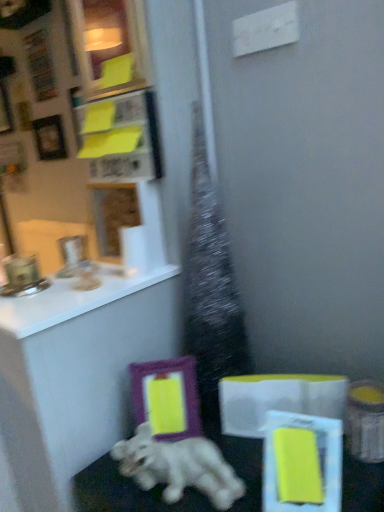
Question: Is matte yellow picture frame at upper left, arranged as the second picture frame when viewed from the top, in contact with white glossy countertop at upper left?

Choices:
 (A) no
 (B) yes

Answer: (A)

Question: Is white glossy countertop at upper left located within matte yellow picture frame at upper left, which is the 3th picture frame from left to right?

Choices:
 (A) no
 (B) yes

Answer: (A)

Question: Is matte yellow picture frame at upper left, which is the 3th picture frame from left to right, taller than white glossy countertop at upper left?

Choices:
 (A) no
 (B) yes

Answer: (B)

Question: From a real-world perspective, is matte yellow picture frame at upper left, arranged as the second picture frame when viewed from the top, under white glossy countertop at upper left?

Choices:
 (A) no
 (B) yes

Answer: (A)

Question: Is white glossy countertop at upper left at the back of matte yellow picture frame at upper left, the 4th picture frame in the back-to-front sequence?

Choices:
 (A) yes
 (B) no

Answer: (B)

Question: From the image's perspective, is white glossy countertop at upper left located above or below white glossy elephant at lower center?

Choices:
 (A) below
 (B) above

Answer: (B)

Question: Looking at the image, does white glossy countertop at upper left seem bigger or smaller compared to white glossy elephant at lower center?

Choices:
 (A) big
 (B) small

Answer: (B)

Question: Is point (89, 290) positioned closer to the camera than point (258, 460)?

Choices:
 (A) closer
 (B) farther

Answer: (B)

Question: Considering the positions of white glossy countertop at upper left and white glossy elephant at lower center in the image, is white glossy countertop at upper left wider or thinner than white glossy elephant at lower center?

Choices:
 (A) wide
 (B) thin

Answer: (B)

Question: Considering the positions of purple matte picture frame at lower center, which is the fourth picture frame from left to right, and white glossy dog at lower center in the image, is purple matte picture frame at lower center, which is the fourth picture frame from left to right, wider or thinner than white glossy dog at lower center?

Choices:
 (A) wide
 (B) thin

Answer: (B)

Question: Is purple matte picture frame at lower center, the third picture frame positioned from the back, spatially inside white glossy dog at lower center, or outside of it?

Choices:
 (A) outside
 (B) inside

Answer: (A)

Question: From the image's perspective, is purple matte picture frame at lower center, which is the fourth picture frame from left to right, above or below white glossy dog at lower center?

Choices:
 (A) below
 (B) above

Answer: (B)

Question: Considering the positions of purple matte picture frame at lower center, the 2th picture frame from the front, and white glossy dog at lower center in the image, is purple matte picture frame at lower center, the 2th picture frame from the front, taller or shorter than white glossy dog at lower center?

Choices:
 (A) tall
 (B) short

Answer: (A)

Question: Is point (157, 391) closer or farther from the camera than point (11, 115)?

Choices:
 (A) farther
 (B) closer

Answer: (B)

Question: From their relative heights in the image, would you say purple matte picture frame at lower center, which is the fourth picture frame from left to right, is taller or shorter than matte purple picture frame at upper left, positioned as the 4th picture frame in front-to-back order?

Choices:
 (A) tall
 (B) short

Answer: (B)